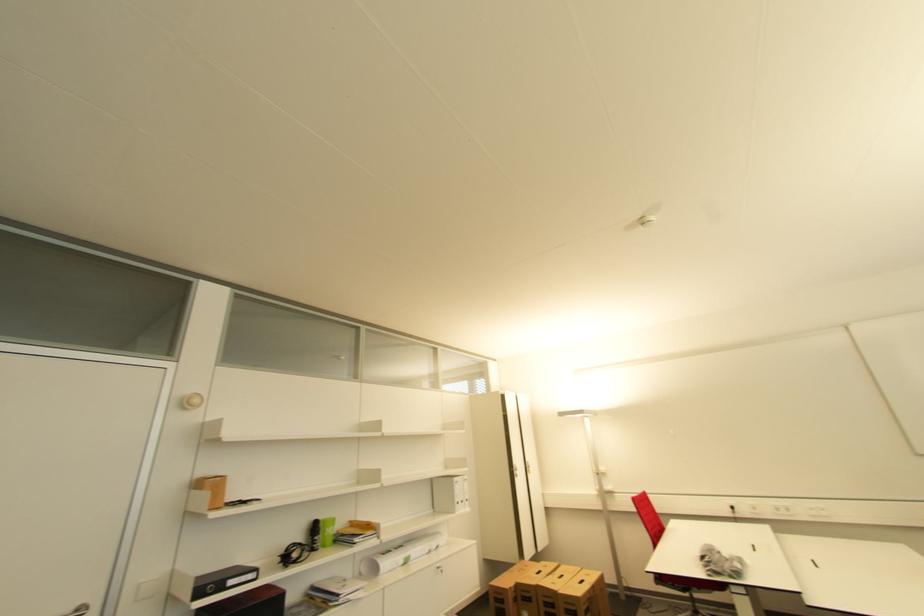
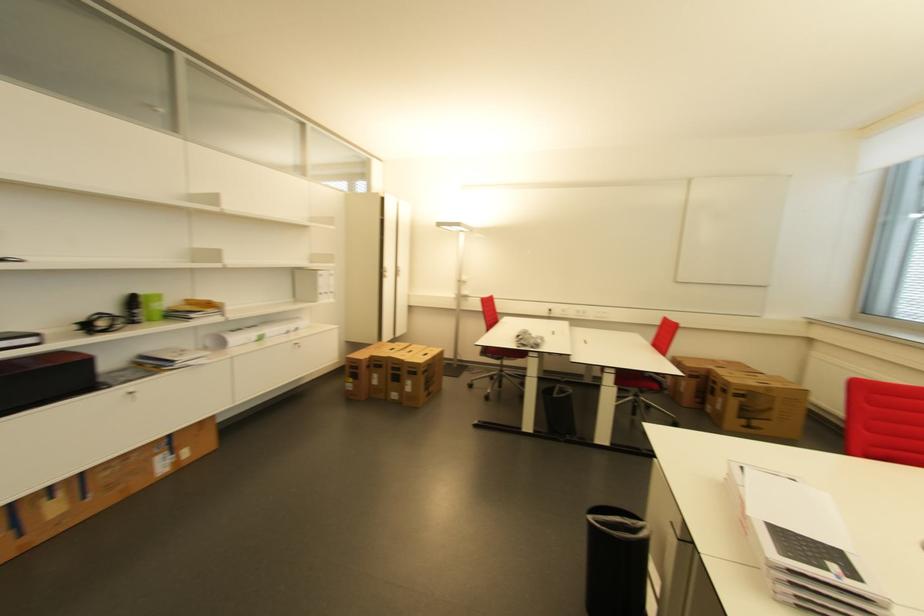
The point at [443,570] is marked in the first image. Where is the corresponding point in the second image?

(300, 345)